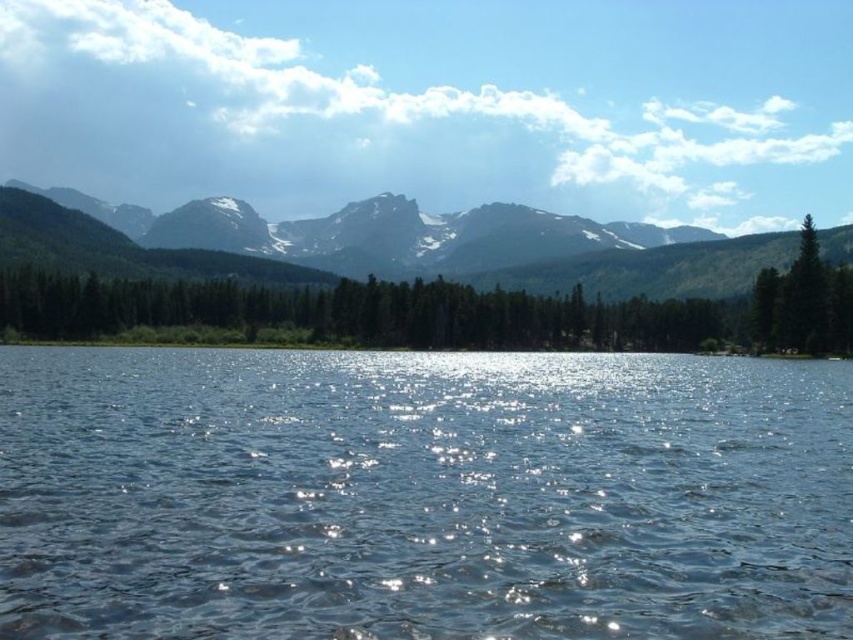
Question: Based on their relative distances, which object is farther from the green matte trees at center?

Choices:
 (A) clear water at center
 (B) green matte tree at right

Answer: (A)

Question: Where is green matte trees at center located in relation to green matte tree at right in the image?

Choices:
 (A) right
 (B) left

Answer: (B)

Question: Estimate the real-world distances between objects in this image. Which object is farther from the green matte tree at right?

Choices:
 (A) clear water at center
 (B) sandy brown rock formation at upper center
 (C) green matte trees at center

Answer: (B)

Question: Where is clear water at center located in relation to green matte tree at right in the image?

Choices:
 (A) left
 (B) right

Answer: (A)

Question: Estimate the real-world distances between objects in this image. Which object is farther from the green matte trees at center?

Choices:
 (A) clear water at center
 (B) sandy brown rock formation at upper center
 (C) green matte tree at right

Answer: (A)

Question: Is sandy brown rock formation at upper center smaller than green matte tree at right?

Choices:
 (A) no
 (B) yes

Answer: (A)